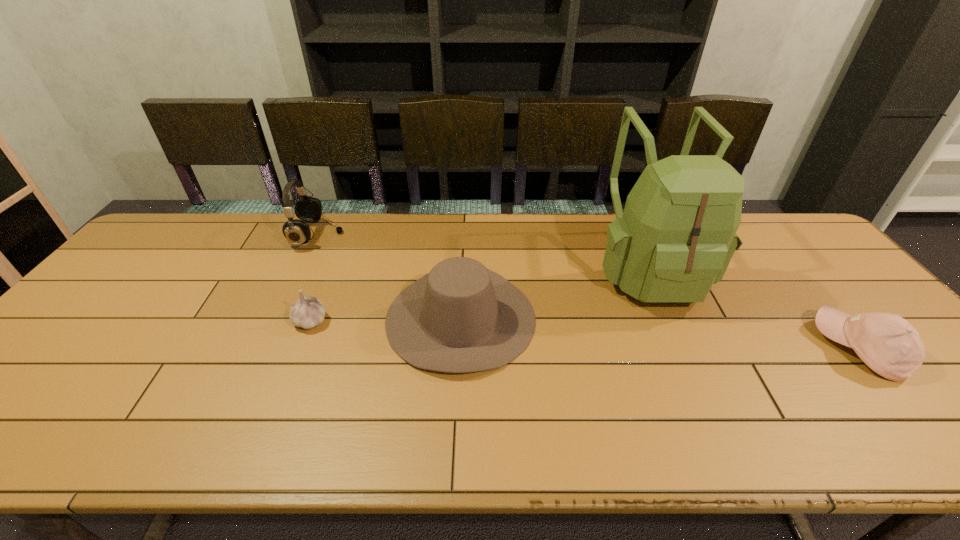
In the image, there is a desktop. What are the coordinates of `blank space at the near right corner` in the screenshot? It's located at (949, 416).

The width and height of the screenshot is (960, 540). Find the location of `free point between the garlic and the baseball cap`. free point between the garlic and the baseball cap is located at coordinates (585, 334).

Identify the location of free space between the cowboy hat and the garlic. Image resolution: width=960 pixels, height=540 pixels. (385, 319).

At what (x,y) coordinates should I click in order to perform the action: click on unoccupied position between the fourth shortest object and the rightmost object. Please return your answer as a coordinate pair (x, y). Looking at the image, I should click on (588, 292).

Locate an element on the screen. Image resolution: width=960 pixels, height=540 pixels. free space between the backpack and the baseball cap is located at coordinates (754, 308).

I want to click on empty location between the cowboy hat and the tallest object, so (x=555, y=293).

You are a GUI agent. You are given a task and a screenshot of the screen. Output one action in this format:
    pyautogui.click(x=<x>, y=<y>)
    Task: Click on the empty space that is in between the cowboy hat and the tallest object
    This screenshot has width=960, height=540.
    Given the screenshot: What is the action you would take?
    pyautogui.click(x=555, y=293)

Where is `empty location between the garlic and the second tallest object`? empty location between the garlic and the second tallest object is located at coordinates (314, 278).

At what (x,y) coordinates should I click in order to perform the action: click on empty location between the baseball cap and the second tallest object. Please return your answer as a coordinate pair (x, y). This screenshot has width=960, height=540. Looking at the image, I should click on (588, 292).

Where is `free spot between the garlic and the third object from right to left`? free spot between the garlic and the third object from right to left is located at coordinates (385, 319).